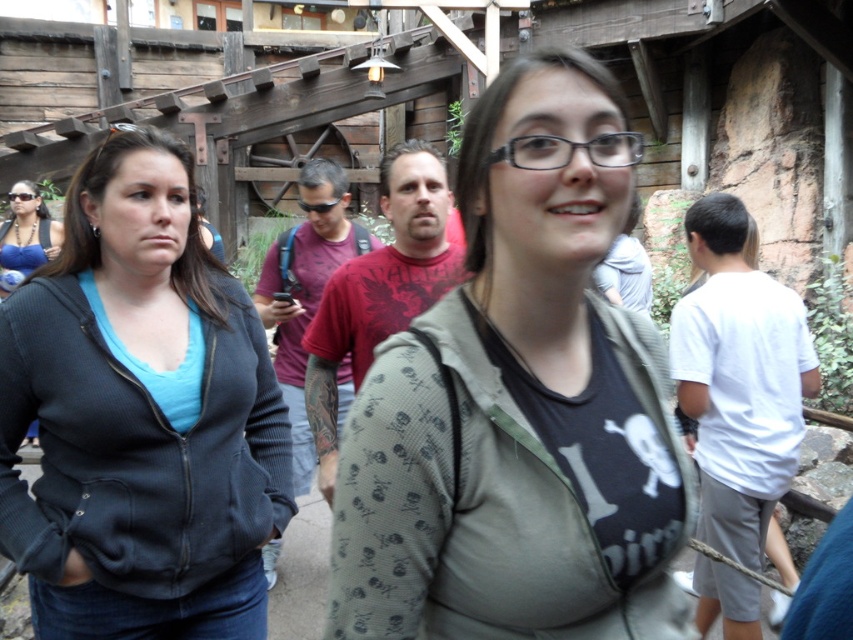
From the picture: Which is above, white cotton shirt at right or matte blue bikini top at upper left?

matte blue bikini top at upper left is higher up.

Image resolution: width=853 pixels, height=640 pixels. What do you see at coordinates (740, 380) in the screenshot?
I see `white cotton shirt at right` at bounding box center [740, 380].

Between point (723, 333) and point (38, 225), which one is positioned in front?

Point (723, 333) is more forward.

Identify the location of white cotton shirt at right. (740, 380).

Which is below, matte olive green hoodie at center or white cotton shirt at right?

Positioned lower is white cotton shirt at right.

The width and height of the screenshot is (853, 640). Describe the element at coordinates (520, 404) in the screenshot. I see `matte olive green hoodie at center` at that location.

Find the location of `matte olive green hoodie at center`. matte olive green hoodie at center is located at coordinates (520, 404).

Which of these two, matte black hoodie at center or white cotton shirt at right, stands taller?

white cotton shirt at right

Is matte black hoodie at center thinner than white cotton shirt at right?

Yes, matte black hoodie at center is thinner than white cotton shirt at right.

Between point (129, 268) and point (672, 308), which one is positioned in front?

Point (129, 268) is more forward.

The width and height of the screenshot is (853, 640). Find the location of `matte black hoodie at center`. matte black hoodie at center is located at coordinates (140, 416).